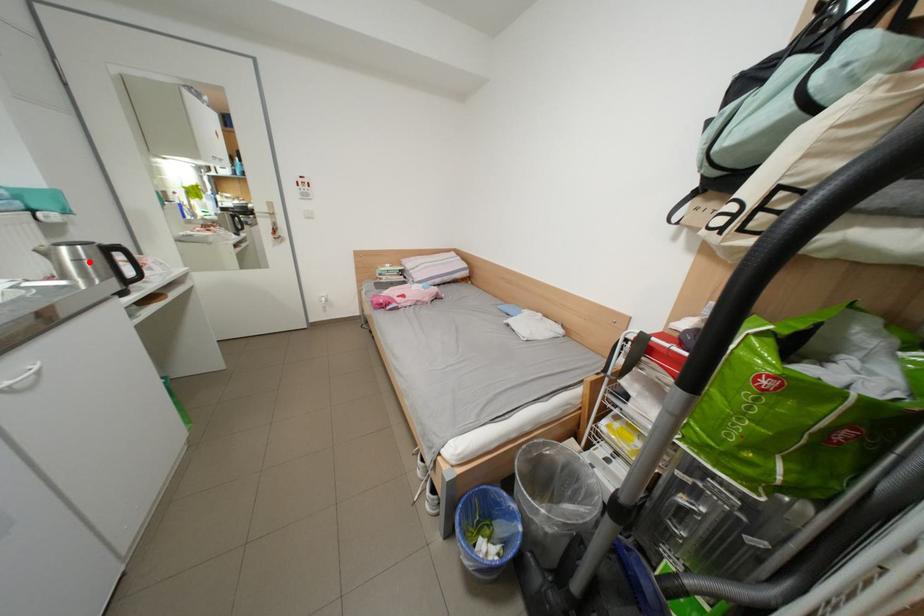
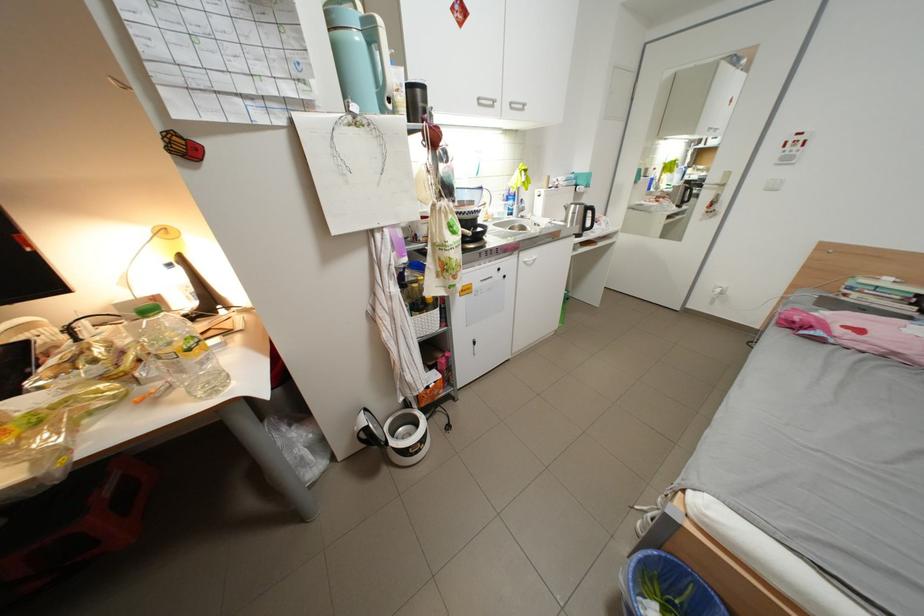
Find the pixel in the second image that matches the highlighted location in the first image.

(585, 215)